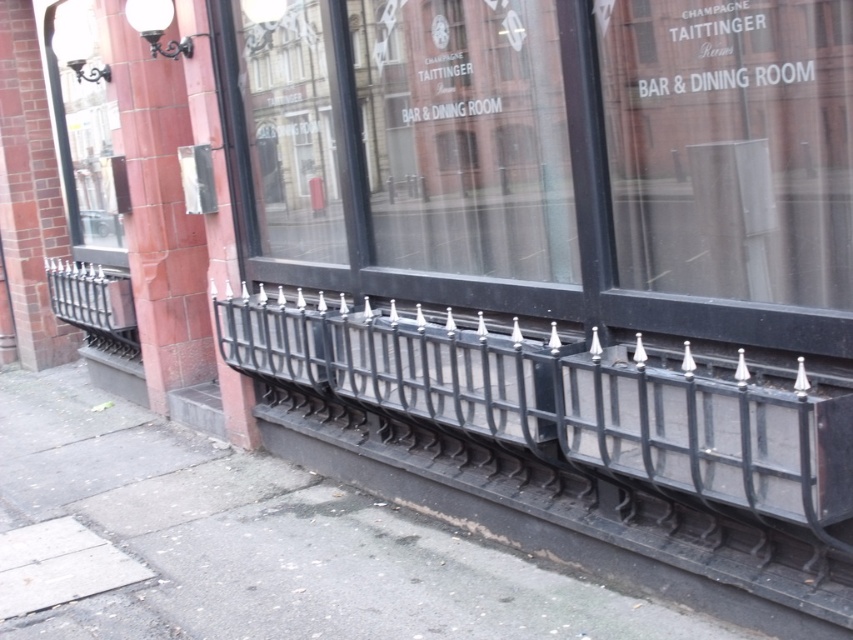
Does black wrought iron fence at lower center appear over transparent glass window at center?

No, black wrought iron fence at lower center is not above transparent glass window at center.

Is point (764, 545) more distant than point (656, 275)?

No.

What do you see at coordinates (572, 417) in the screenshot?
I see `black wrought iron fence at lower center` at bounding box center [572, 417].

Where is `black wrought iron fence at lower center`? Image resolution: width=853 pixels, height=640 pixels. black wrought iron fence at lower center is located at coordinates (572, 417).

From the picture: Who is higher up, transparent glass window at center or matte glass window at upper left?

matte glass window at upper left is above.

Is transparent glass window at center taller than matte glass window at upper left?

No.

Who is more forward, (815, 205) or (103, 104)?

Positioned in front is point (815, 205).

Locate an element on the screen. The width and height of the screenshot is (853, 640). transparent glass window at center is located at coordinates (730, 147).

Between black metal railing at lower center and transparent glass window at center, which one has more height?

transparent glass window at center is taller.

Which is in front, point (630, 628) or point (836, 224)?

Point (836, 224) is in front.

Does point (178, 513) come farther from viewer compared to point (679, 160)?

Yes, point (178, 513) is farther from viewer.

Identify the location of black metal railing at lower center. (250, 545).